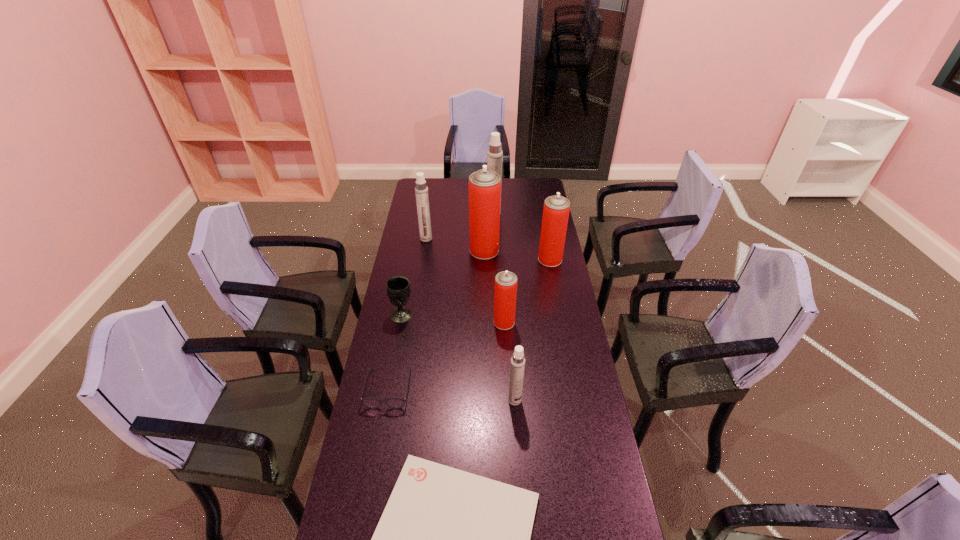
Find the location of a particular element. The width and height of the screenshot is (960, 540). free spot between the nearest white aerosol can and the rightmost object is located at coordinates tap(533, 330).

The image size is (960, 540). I want to click on vacant space that's between the farthest white aerosol can and the nearest red aerosol can, so click(x=499, y=268).

This screenshot has height=540, width=960. In order to click on unoccupied position between the rightmost object and the nearest aerosol can in this screenshot , I will do `click(533, 330)`.

Find the location of `vacant space that's between the smallest white aerosol can and the rightmost red aerosol can`. vacant space that's between the smallest white aerosol can and the rightmost red aerosol can is located at coordinates (533, 330).

In order to click on vacant area that lies between the second biggest red aerosol can and the chalice in this screenshot , I will do `click(476, 287)`.

Identify which object is located as the sixth nearest to the nearest aerosol can. Please provide its 2D coordinates. Your answer should be formatted as a tuple, i.e. [(x, y)], where the tuple contains the x and y coordinates of a point satisfying the conditions above.

[(484, 185)]

Where is `object that is the fifth closest one to the smallest red aerosol can`? object that is the fifth closest one to the smallest red aerosol can is located at coordinates (484, 185).

Locate an element on the screen. The width and height of the screenshot is (960, 540). the sixth closest aerosol can to the shortest object is located at coordinates (494, 155).

Image resolution: width=960 pixels, height=540 pixels. Find the location of `aerosol can that is the closest to the second farthest white aerosol can`. aerosol can that is the closest to the second farthest white aerosol can is located at coordinates (484, 185).

Locate which white aerosol can ranks in proximity to the biggest red aerosol can. Please provide its 2D coordinates. Your answer should be formatted as a tuple, i.e. [(x, y)], where the tuple contains the x and y coordinates of a point satisfying the conditions above.

[(421, 190)]